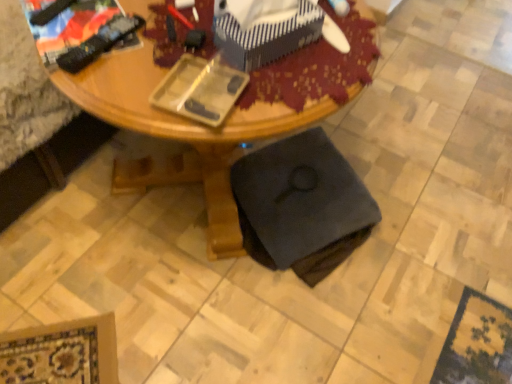
At what (x,y) coordinates should I click in order to perform the action: click on vacant space in front of wooden desk at center. Please return your answer as a coordinate pair (x, y). Looking at the image, I should click on (174, 321).